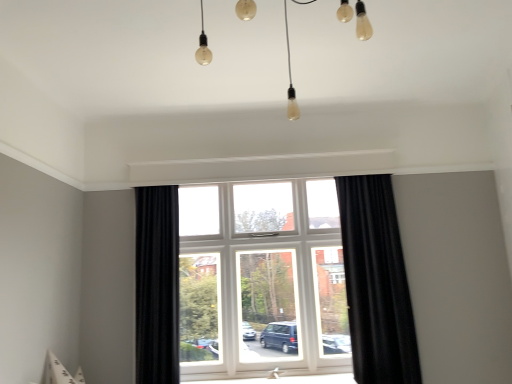
Question: Does black velvet curtain at center, placed as the 1th curtain when sorted from left to right, have a lesser width compared to white plastic window at center?

Choices:
 (A) yes
 (B) no

Answer: (B)

Question: Is black velvet curtain at center, placed as the second curtain when sorted from right to left, with white plastic window at center?

Choices:
 (A) no
 (B) yes

Answer: (A)

Question: Is black velvet curtain at center, placed as the 1th curtain when sorted from left to right, not within white plastic window at center?

Choices:
 (A) no
 (B) yes

Answer: (B)

Question: Can you confirm if black velvet curtain at center, placed as the second curtain when sorted from right to left, is smaller than white plastic window at center?

Choices:
 (A) no
 (B) yes

Answer: (B)

Question: From the image's perspective, is black velvet curtain at center, placed as the 1th curtain when sorted from left to right, on top of white plastic window at center?

Choices:
 (A) yes
 (B) no

Answer: (B)

Question: In the image, is black velvet curtain at center, placed as the second curtain when sorted from right to left, on the left side or the right side of white plastic window at center?

Choices:
 (A) right
 (B) left

Answer: (B)

Question: Considering their positions, is black velvet curtain at center, placed as the 1th curtain when sorted from left to right, located in front of or behind white plastic window at center?

Choices:
 (A) behind
 (B) front

Answer: (B)

Question: From the image's perspective, is black velvet curtain at center, placed as the second curtain when sorted from right to left, positioned above or below white plastic window at center?

Choices:
 (A) below
 (B) above

Answer: (A)

Question: Considering the positions of black velvet curtain at center, placed as the second curtain when sorted from right to left, and white plastic window at center in the image, is black velvet curtain at center, placed as the second curtain when sorted from right to left, wider or thinner than white plastic window at center?

Choices:
 (A) thin
 (B) wide

Answer: (B)

Question: From a real-world perspective, relative to white plastic window at center, is matte glass light bulbs at upper center vertically above or below?

Choices:
 (A) above
 (B) below

Answer: (A)

Question: Relative to white plastic window at center, is matte glass light bulbs at upper center in front or behind?

Choices:
 (A) behind
 (B) front

Answer: (B)

Question: From the image's perspective, is matte glass light bulbs at upper center above or below white plastic window at center?

Choices:
 (A) below
 (B) above

Answer: (B)

Question: Is matte glass light bulbs at upper center situated inside white plastic window at center or outside?

Choices:
 (A) outside
 (B) inside

Answer: (A)

Question: Is black textured curtain at right, arranged as the 1th curtain when viewed from the right, taller or shorter than black velvet curtain at center, placed as the second curtain when sorted from right to left?

Choices:
 (A) short
 (B) tall

Answer: (B)

Question: Is point (401, 281) closer or farther from the camera than point (162, 231)?

Choices:
 (A) farther
 (B) closer

Answer: (B)